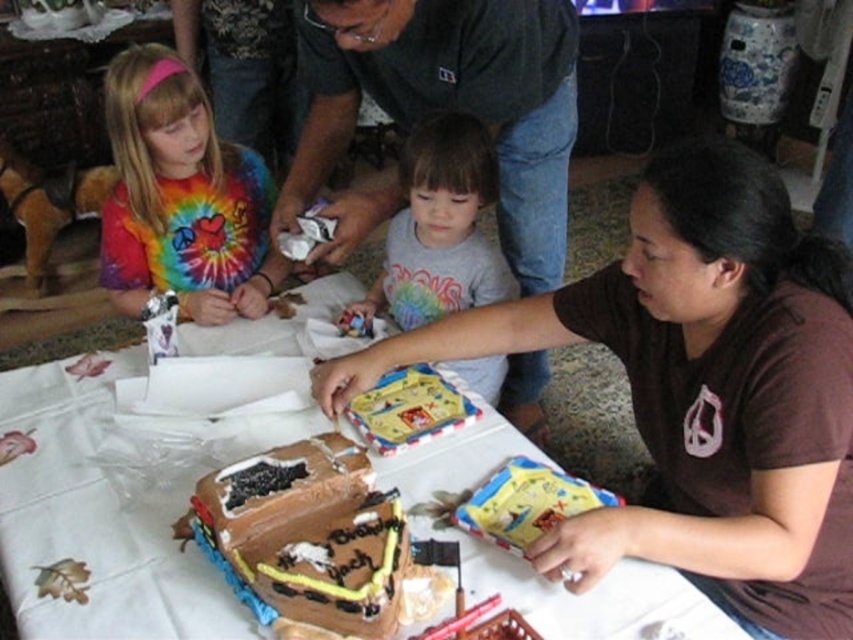
You are a guest at the birthday party and want to take a photo with the dark gray shirt at center and the chocolate fondant cake at center. To ensure both are in the frame, which side of the cake should you stand to capture both objects?

You should stand to the left side of the chocolate fondant cake at center so that both the dark gray shirt at center and the cake are visible in the photo frame since the shirt is positioned to the right of the cake.